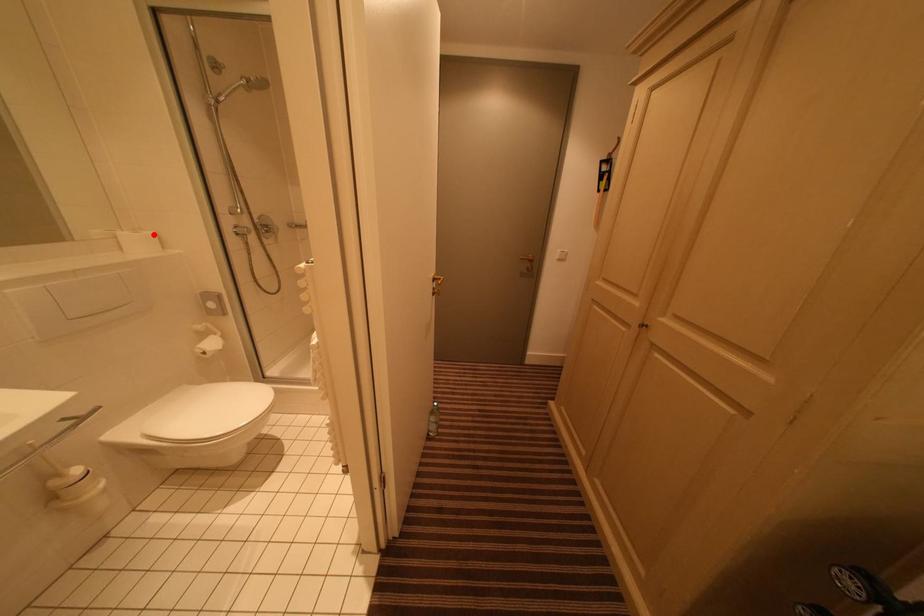
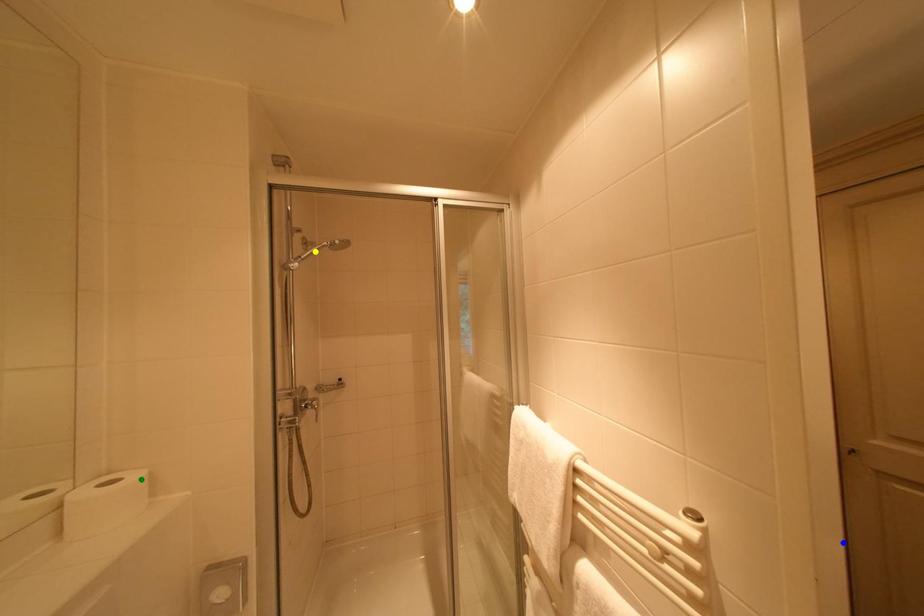
Question: I am providing you with two images of the same scene from different viewpoints. A red point is marked on the first image. You are given multiple points on the second image. Which spot in image 2 lines up with the point in image 1?

Choices:
 (A) green point
 (B) yellow point
 (C) blue point

Answer: (A)